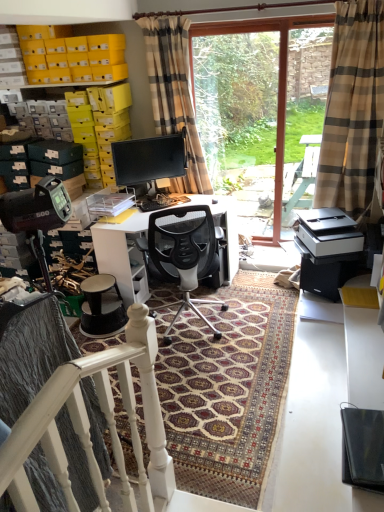
Question: Is plaid fabric curtain at center, the second curtain from the right, to the left or to the right of black plastic printer at lower right in the image?

Choices:
 (A) right
 (B) left

Answer: (B)

Question: Is plaid fabric curtain at center, the first curtain viewed from the left, inside or outside of black plastic printer at lower right?

Choices:
 (A) outside
 (B) inside

Answer: (A)

Question: Considering the real-world distances, which object is farthest from the matte black monitor at center?

Choices:
 (A) black mesh office chair at center
 (B) beige plaid curtain at right, which appears as the second curtain when viewed from the left
 (C) black textured stool at lower left
 (D) transparent glass door at center
 (E) white glossy desk at center

Answer: (B)

Question: Which is nearer to the black plastic printer at lower right?

Choices:
 (A) plaid fabric curtain at center, the first curtain viewed from the left
 (B) matte black monitor at center
 (C) white glossy desk at center
 (D) beige plaid curtain at right, which appears as the second curtain when viewed from the left
 (E) transparent glass door at center

Answer: (D)